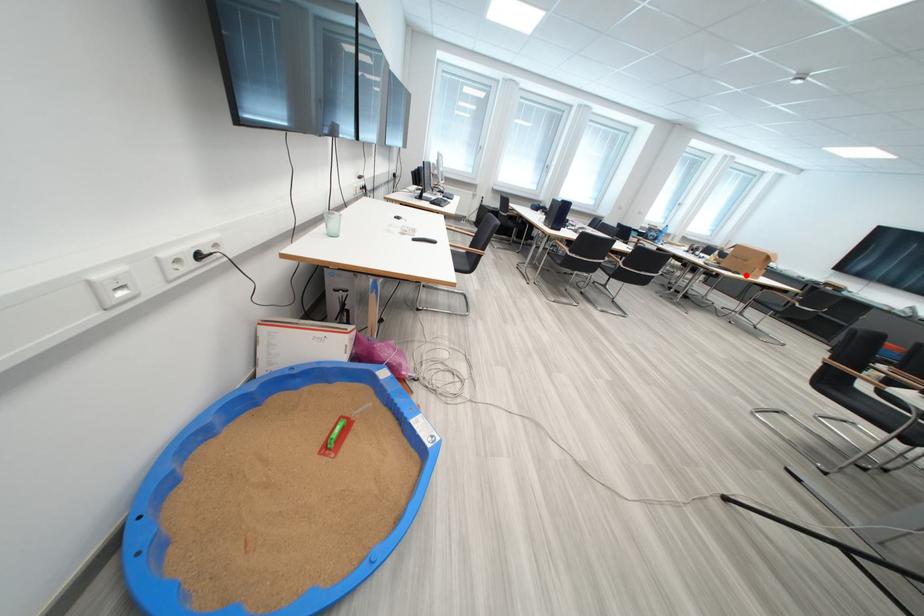
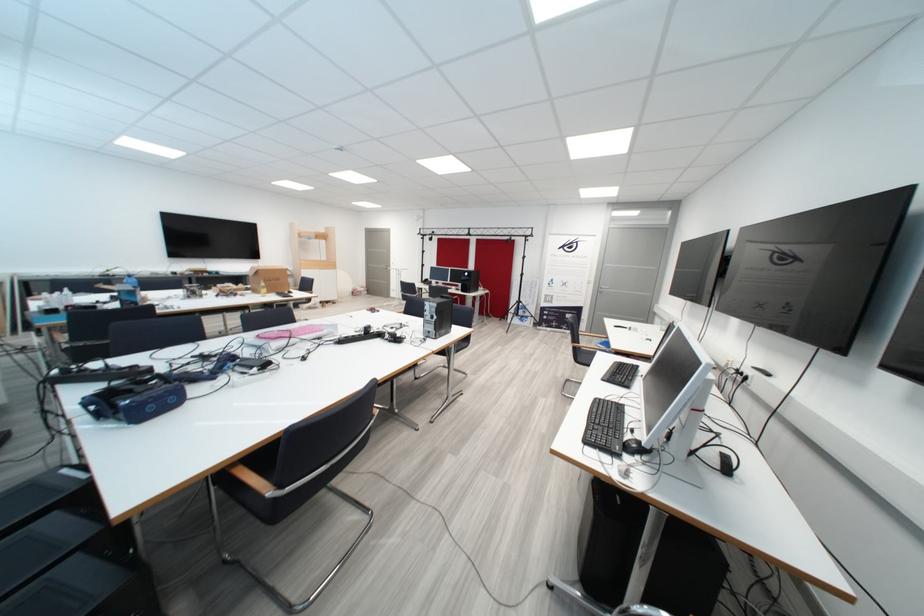
Question: I am providing you with two images of the same scene from different viewpoints. A red point is marked on the first image. Is the red point's position out of view in image 2?

Choices:
 (A) Yes
 (B) No

Answer: (A)